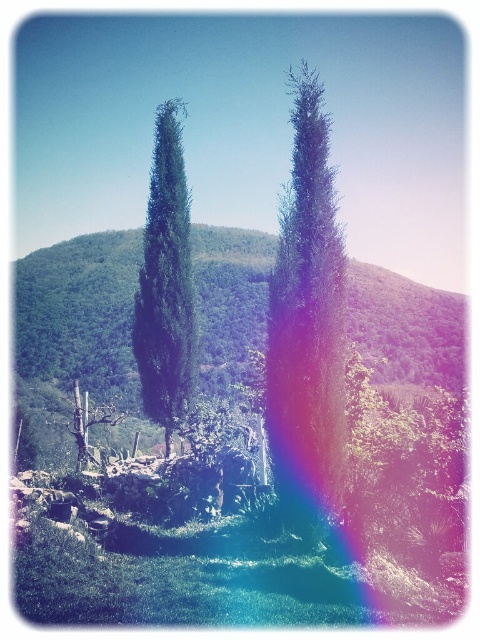
You are standing at the point labeled as point (307,321) in the image. Describe what you see directly in front of you.

The point labeled as point (307,321) indicates a green textured tree at center, so directly in front of you is the green textured tree at center.

You are an artist sketching the landscape and want to place the green textured tree at center and the green matte tree at center accurately. Which one should you draw first if you want to start with the one on the left?

You should draw the green matte tree at center first because it is positioned to the left of the green textured tree at center.

You are a hiker planning to take a photo of both the green textured tree at center and the green matte tree at center. You want to ensure both trees are in focus. If your camera can only focus on objects within a 20 meter range, will you be able to capture both trees in the same photo?

The green textured tree at center is 21.47 meters away from the green matte tree at center. Since the distance between them exceeds the camera focus range of 20 meters, you may not be able to have both trees in focus simultaneously in the same photo.